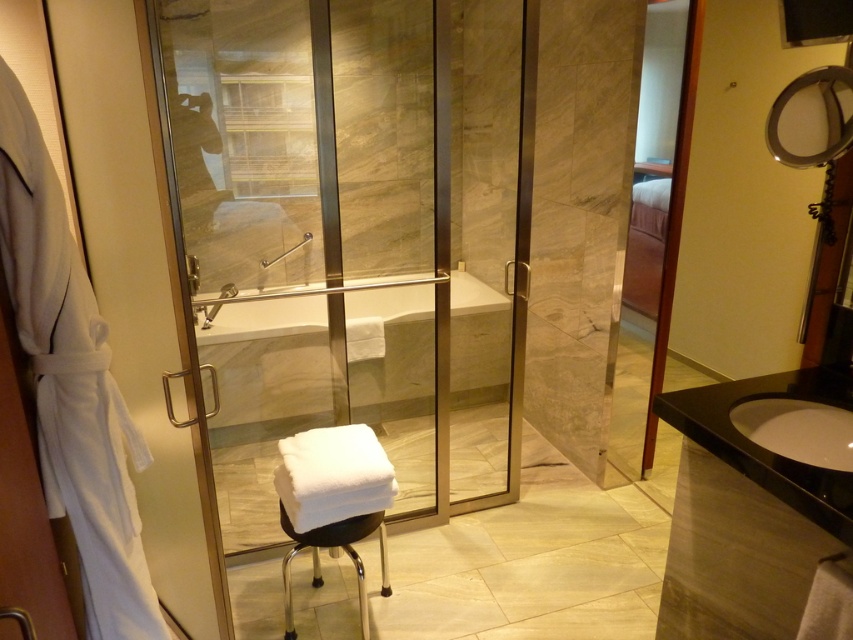
Question: Does transparent glass door at center appear on the left side of wooden screen door at center-right?

Choices:
 (A) yes
 (B) no

Answer: (A)

Question: Considering the relative positions of white soft bathrobe at left and white fabric stool at center in the image provided, where is white soft bathrobe at left located with respect to white fabric stool at center?

Choices:
 (A) left
 (B) right

Answer: (A)

Question: Which is farther from the transparent glass door at center?

Choices:
 (A) wooden screen door at center-right
 (B) white soft bathrobe at left

Answer: (B)

Question: Is white glossy sink at right thinner than white fabric stool at center?

Choices:
 (A) no
 (B) yes

Answer: (B)

Question: Which is nearer to the transparent glass door at center?

Choices:
 (A) white marble bathtub at center
 (B) white fabric stool at center
 (C) white glossy sink at right
 (D) matte glass shower at center

Answer: (A)

Question: Which is farther from the wooden screen door at center-right?

Choices:
 (A) matte glass shower at center
 (B) white soft bathrobe at left

Answer: (B)